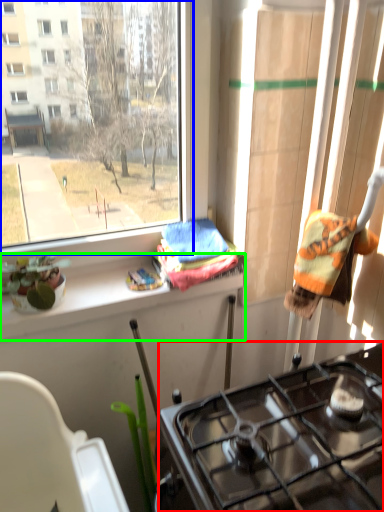
Question: Which object is the farthest from gas stove (highlighted by a red box)? Choose among these: window (highlighted by a blue box) or ledge (highlighted by a green box).

Choices:
 (A) window
 (B) ledge

Answer: (A)